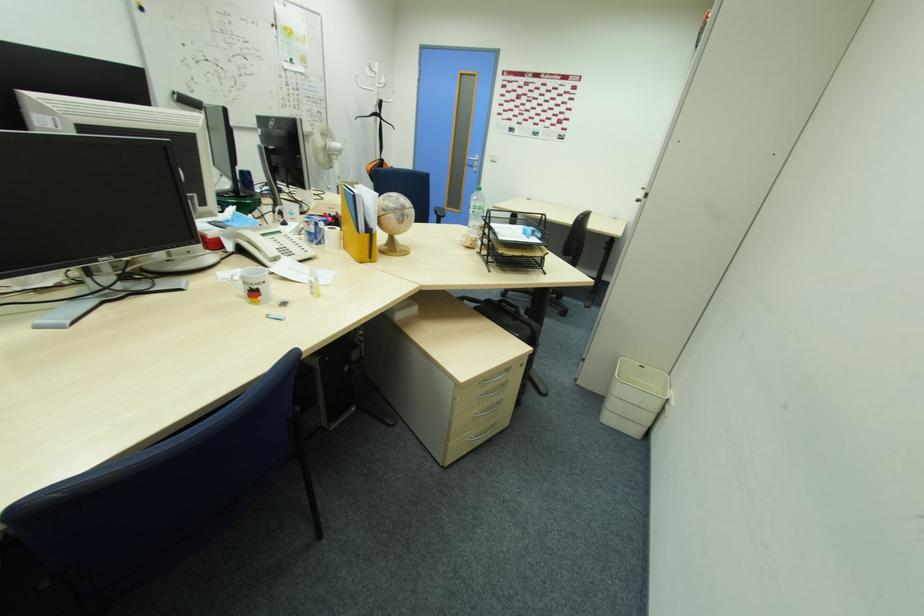
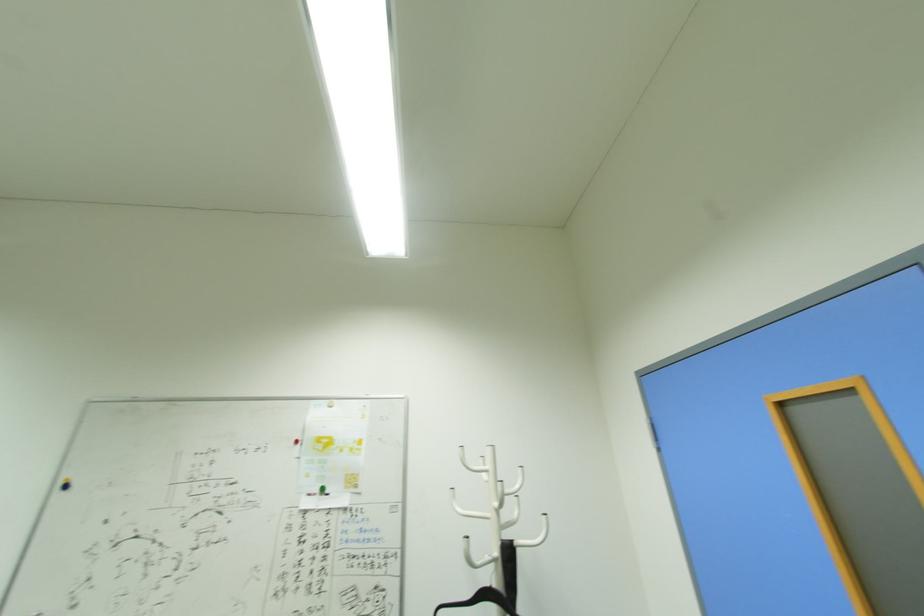
Find the pixel in the second image that matches (x=387, y=102) in the first image.

(518, 544)